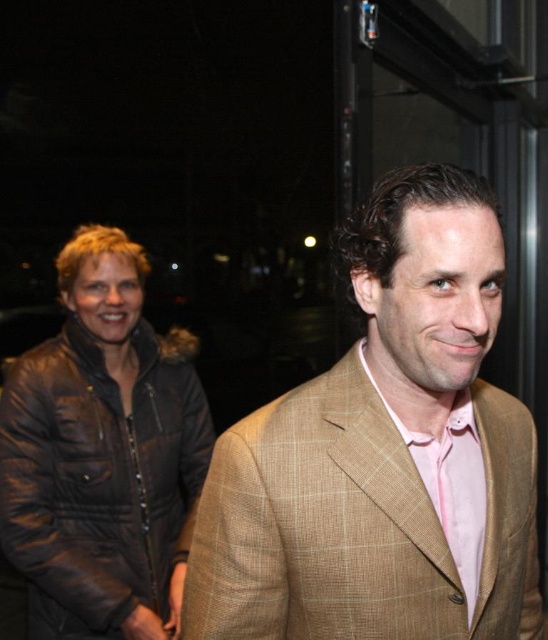
Question: Among these points, which one is farthest from the camera?

Choices:
 (A) (256, 449)
 (B) (118, 582)

Answer: (B)

Question: Is tan plaid suit at center to the right of brown leather jacket at left from the viewer's perspective?

Choices:
 (A) no
 (B) yes

Answer: (B)

Question: Which object is closer to the camera taking this photo?

Choices:
 (A) tan plaid suit at center
 (B) brown leather jacket at left

Answer: (A)

Question: Among these points, which one is farthest from the camera?

Choices:
 (A) (179, 449)
 (B) (335, 545)

Answer: (A)

Question: Does tan plaid suit at center appear under brown leather jacket at left?

Choices:
 (A) yes
 (B) no

Answer: (B)

Question: Does tan plaid suit at center appear over brown leather jacket at left?

Choices:
 (A) yes
 (B) no

Answer: (A)